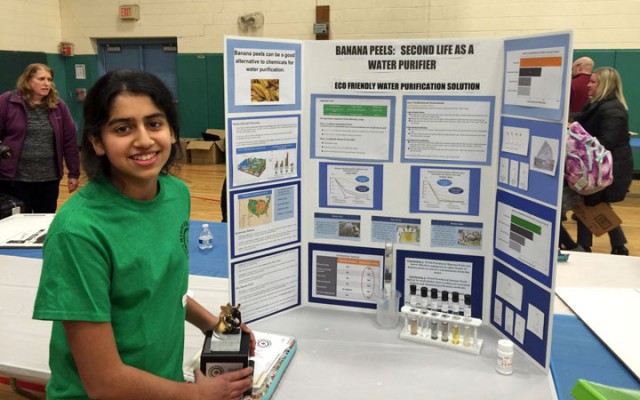
At what (x,y) coordinates should I click in order to perform the action: click on dark aqua wall. Please return your answer as a coordinate pair (x, y). This screenshot has width=640, height=400. Looking at the image, I should click on (201, 78).